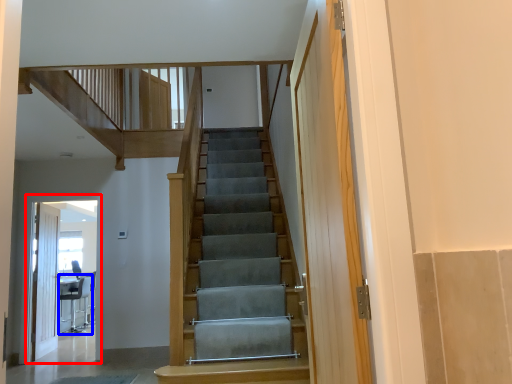
Question: Which object appears farthest to the camera in this image, elevator (highlighted by a red box) or chair (highlighted by a blue box)?

Choices:
 (A) elevator
 (B) chair

Answer: (B)